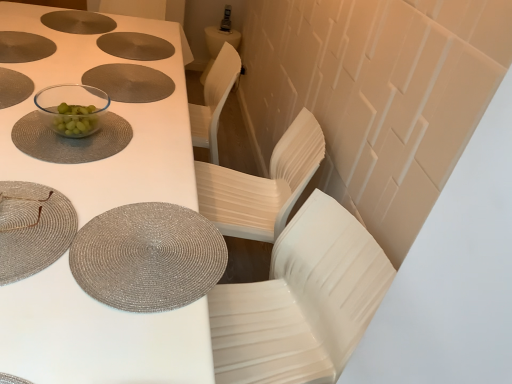
Identify the location of spots to the right of transparent glass bowl at center, positioned as the fourth tableware in front-to-back order. Image resolution: width=512 pixels, height=384 pixels. (123, 141).